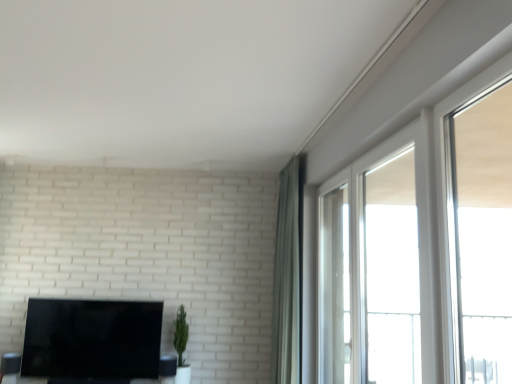
Question: In terms of width, does black glossy tv at lower left look wider or thinner when compared to clear glass window at upper right, the 2th window in the front-to-back sequence?

Choices:
 (A) thin
 (B) wide

Answer: (B)

Question: Is point click(x=126, y=309) closer or farther from the camera than point click(x=374, y=248)?

Choices:
 (A) closer
 (B) farther

Answer: (A)

Question: Which object is the farthest from the green matte plant at center?

Choices:
 (A) clear glass window at right, positioned as the third window in front-to-back order
 (B) transparent glass window at right, the third window from the back
 (C) clear glass window at upper right, the 2th window viewed from the back
 (D) black glossy tv at lower left
 (E) green fabric curtain at upper right

Answer: (B)

Question: Based on their relative distances, which object is nearer to the clear glass window at right, the first window in the back-to-front sequence?

Choices:
 (A) black glossy tv at lower left
 (B) green fabric curtain at upper right
 (C) transparent glass window at right, the 1th window from the front
 (D) clear glass window at upper right, the 2th window in the front-to-back sequence
 (E) green matte plant at center

Answer: (D)